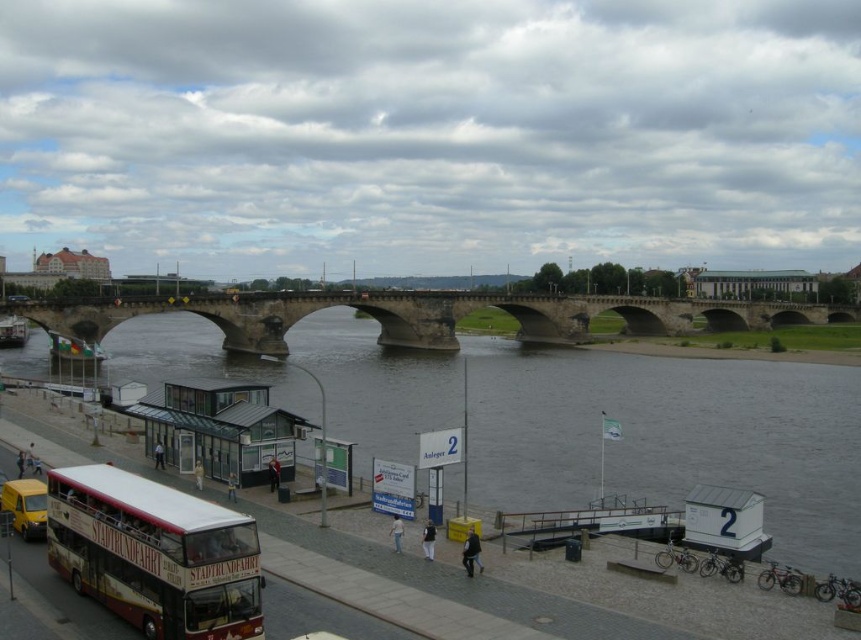
Image resolution: width=861 pixels, height=640 pixels. Describe the element at coordinates (155, 554) in the screenshot. I see `maroon painted double-decker bus at lower left` at that location.

You are a GUI agent. You are given a task and a screenshot of the screen. Output one action in this format:
    pyautogui.click(x=<x>, y=<y>)
    Task: Click on the maroon painted double-decker bus at lower left
    The height and width of the screenshot is (640, 861).
    Given the screenshot: What is the action you would take?
    pyautogui.click(x=155, y=554)

Which is above, gray concrete bridge at center or white glass bus station at lower left?

gray concrete bridge at center is higher up.

Is point (741, 387) in front of point (299, 420)?

No, it is behind (299, 420).

Which is behind, point (793, 468) or point (289, 472)?

Positioned behind is point (793, 468).

Find the location of a particular element. The width and height of the screenshot is (861, 640). gray concrete bridge at center is located at coordinates (611, 417).

Between concrete bridge at center and white glass bus station at lower left, which one appears on the left side from the viewer's perspective?

Positioned to the left is white glass bus station at lower left.

Does concrete bridge at center appear over white glass bus station at lower left?

Correct, concrete bridge at center is located above white glass bus station at lower left.

Measure the distance between concrete bridge at center and camera.

concrete bridge at center and camera are 72.06 meters apart.

Find the location of a particular element. concrete bridge at center is located at coordinates (422, 316).